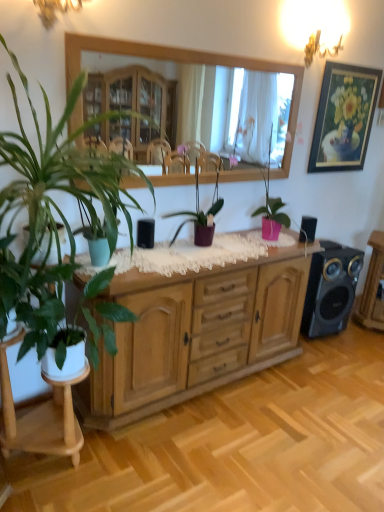
This screenshot has height=512, width=384. I want to click on vacant space in front of black glossy speaker at right, arranged as the first speaker when viewed from the back, so click(x=337, y=353).